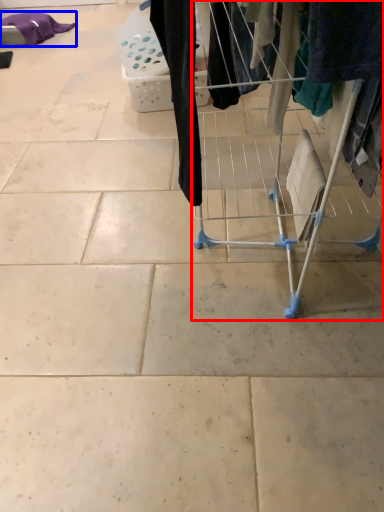
Question: Which of the following is the farthest to the observer, furniture (highlighted by a red box) or clothing (highlighted by a blue box)?

Choices:
 (A) furniture
 (B) clothing

Answer: (B)